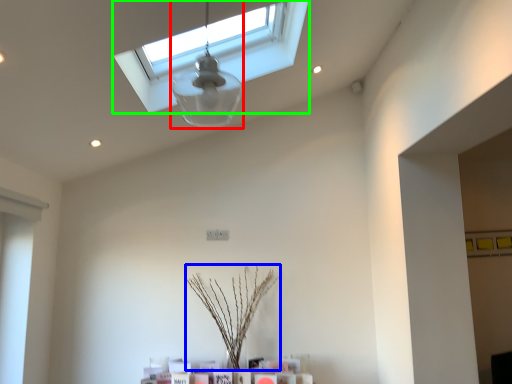
Question: Which object is the closest to the lamp (highlighted by a red box)? Choose among these: plant (highlighted by a blue box) or window (highlighted by a green box).

Choices:
 (A) plant
 (B) window

Answer: (B)